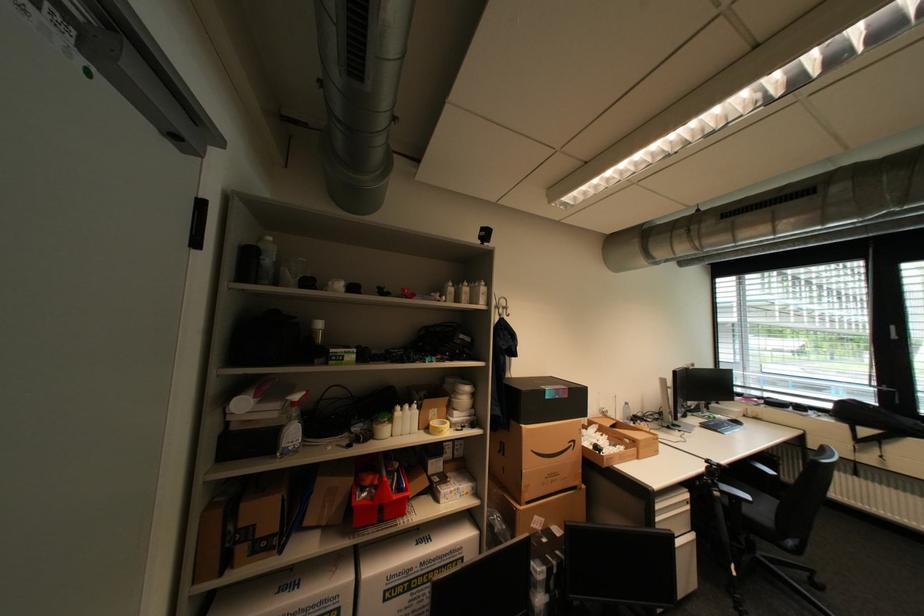
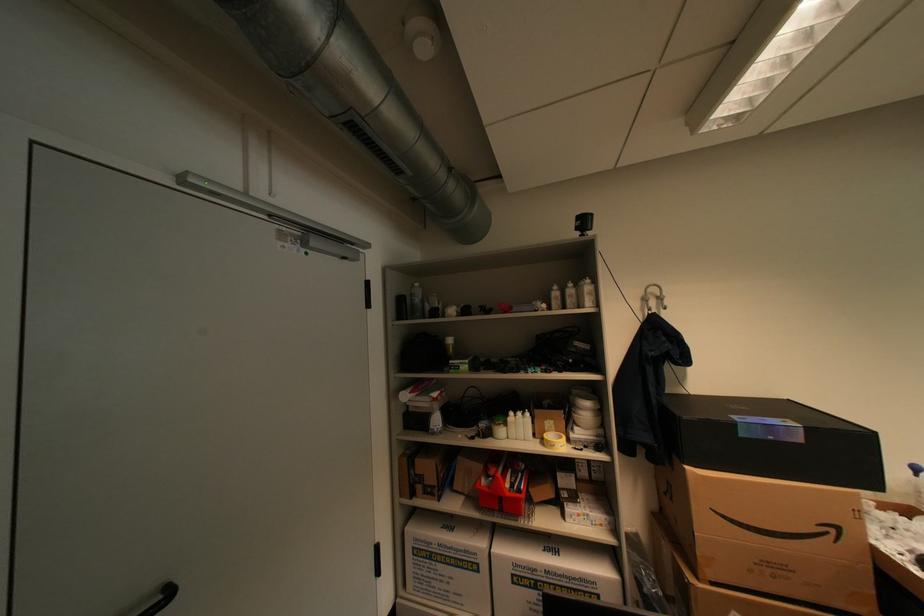
In the second image, find the point that corresponds to point 575,395 in the first image.

(808, 440)